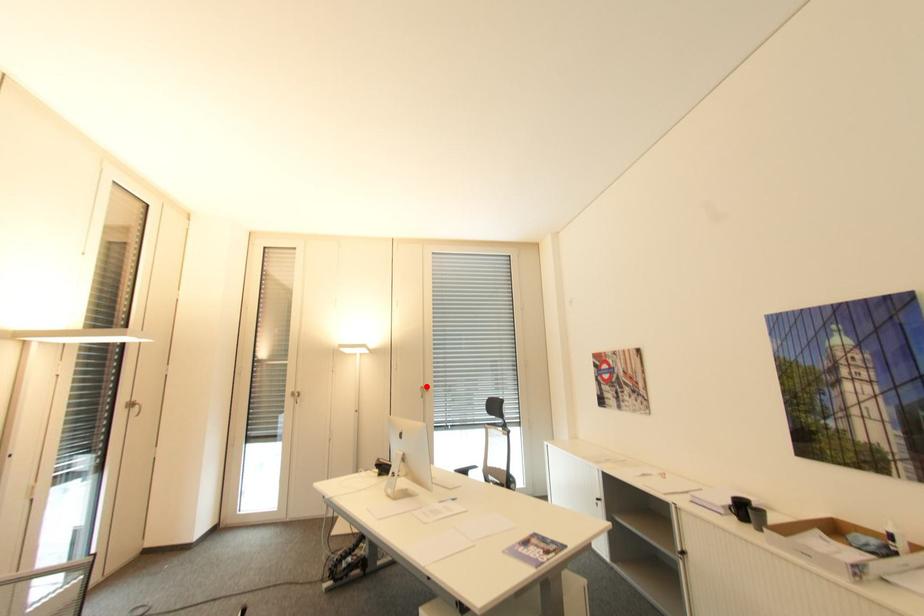
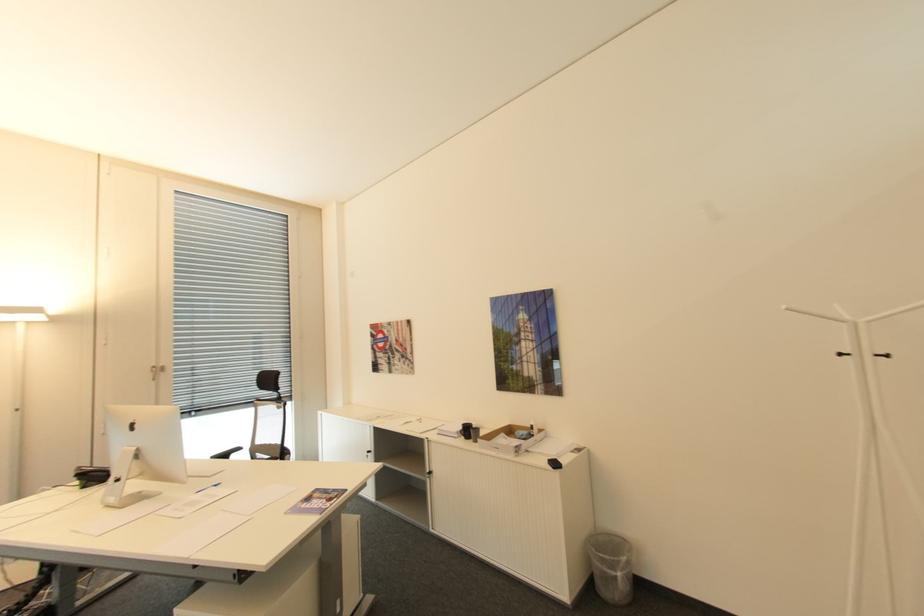
Question: A red point is marked in image1. In image2, is the corresponding 3D point closer to the camera or farther? Reply with the corresponding letter.

Choices:
 (A) The corresponding 3D point is closer.
 (B) The corresponding 3D point is farther.

Answer: (A)